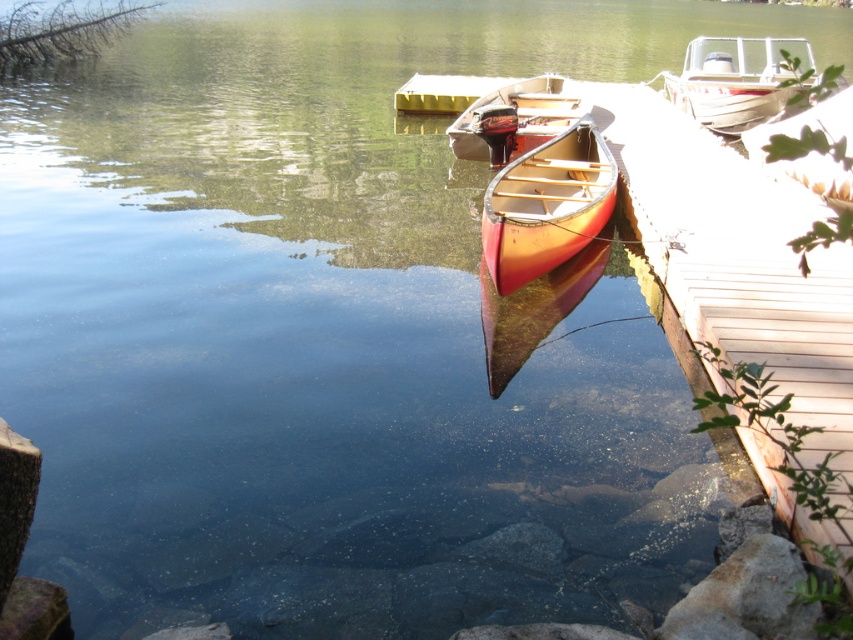
Question: Does matte wood canoe at center have a larger size compared to white matte boat at upper right?

Choices:
 (A) no
 (B) yes

Answer: (A)

Question: Can you confirm if matte wood canoe at center is thinner than white matte boat at upper right?

Choices:
 (A) no
 (B) yes

Answer: (B)

Question: Which object appears farthest from the camera in this image?

Choices:
 (A) white matte boat at upper right
 (B) matte wood canoe at center

Answer: (A)

Question: Which point is farther to the camera?

Choices:
 (A) (563, 237)
 (B) (689, 80)

Answer: (B)

Question: Observing the image, what is the correct spatial positioning of matte wood canoe at center in reference to white matte boat at upper right?

Choices:
 (A) below
 (B) above

Answer: (A)